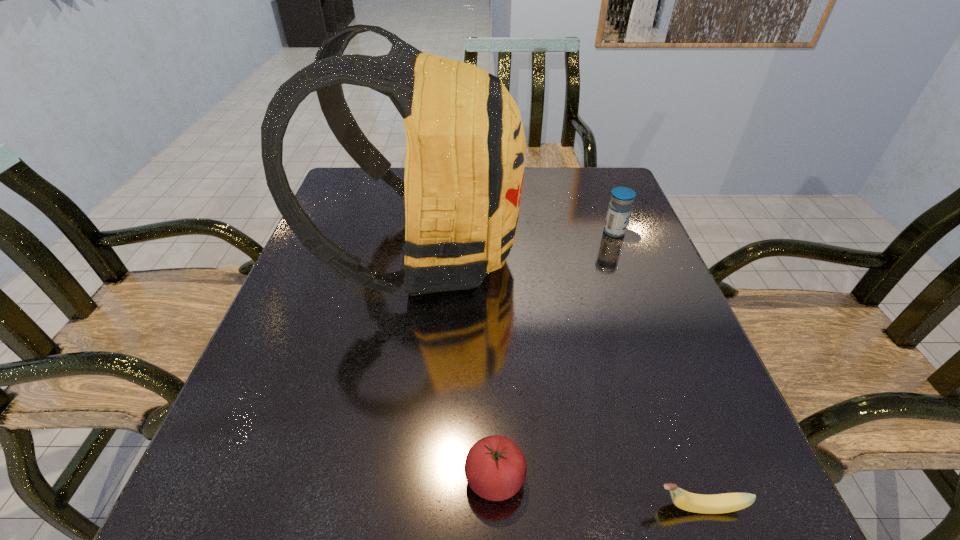
The height and width of the screenshot is (540, 960). In order to click on vacant space at the left edge in this screenshot , I will do `click(342, 340)`.

Where is `vacant space at the right edge of the desktop`? vacant space at the right edge of the desktop is located at coordinates pyautogui.click(x=696, y=453).

The width and height of the screenshot is (960, 540). In the image, there is a desktop. Find the location of `free region at the far left corner`. free region at the far left corner is located at coordinates (372, 207).

Locate an element on the screen. vacant area at the near right corner is located at coordinates (706, 535).

At what (x,y) coordinates should I click in order to perform the action: click on vacant area that lies between the backpack and the second tallest object. Please return your answer as a coordinate pair (x, y). Looking at the image, I should click on (519, 243).

Identify the location of free space between the shortest object and the medicine. This screenshot has width=960, height=540. (657, 369).

What are the coordinates of `empty space between the banana and the tallest object` in the screenshot? It's located at (562, 381).

Locate an element on the screen. vacant space in between the tallest object and the third tallest object is located at coordinates (460, 366).

This screenshot has width=960, height=540. I want to click on vacant point located between the tomato and the banana, so click(597, 492).

Locate an element on the screen. Image resolution: width=960 pixels, height=540 pixels. free space that is in between the third tallest object and the backpack is located at coordinates (460, 366).